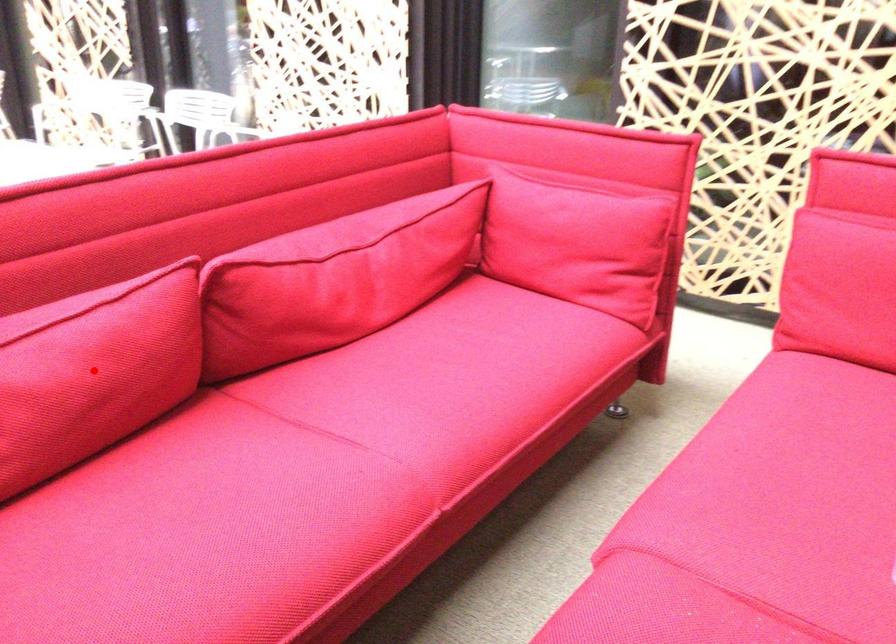
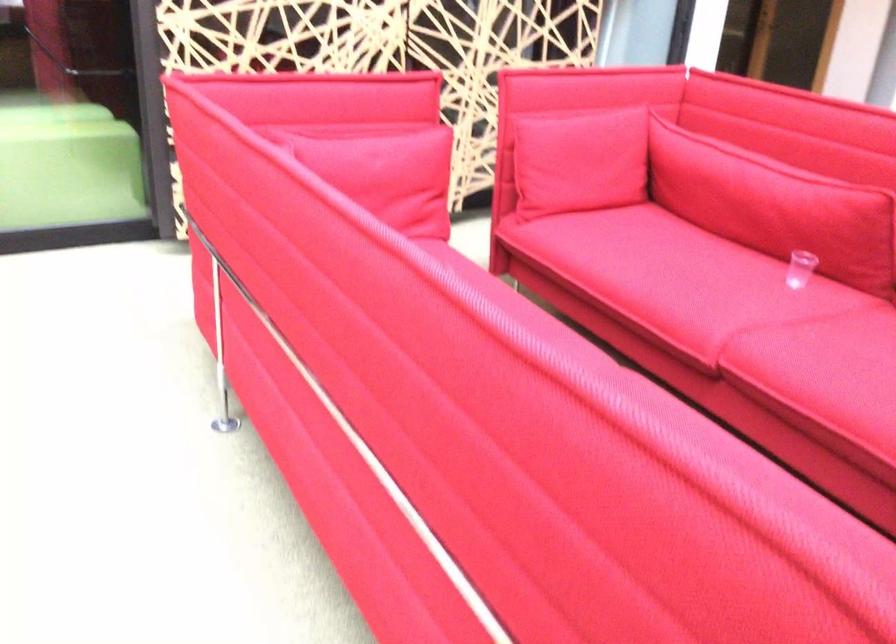
Question: I am providing you with two images of the same scene from different viewpoints. A red point is marked on the first image. Can you still see the location of the red point in image 2?

Choices:
 (A) Yes
 (B) No

Answer: (B)